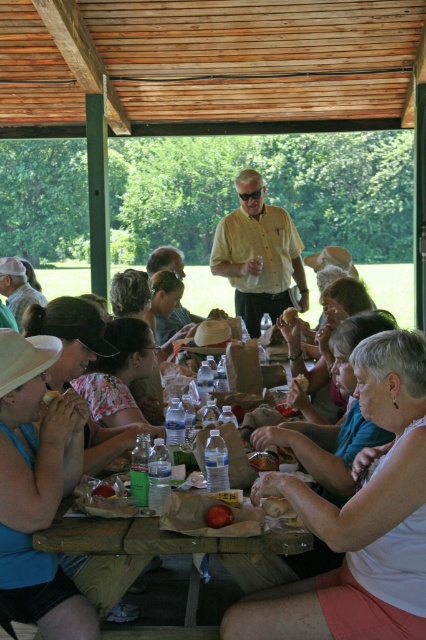
Question: Can you confirm if white cotton shirt at center is positioned to the right of bread at lower right?

Choices:
 (A) yes
 (B) no

Answer: (A)

Question: Which point is closer to the camera?

Choices:
 (A) brown crumbly bread at center
 (B) bread at lower right
 (C) white cotton shirt at center

Answer: (C)

Question: Among these points, which one is farthest from the camera?

Choices:
 (A) (241, 209)
 (B) (8, 410)
 (C) (48, 396)

Answer: (A)

Question: Does white cotton shirt at center lie behind matte yellow bread at lower left?

Choices:
 (A) yes
 (B) no

Answer: (B)

Question: Can you confirm if yellow matte shirt at center is bigger than smooth brown bread at lower left?

Choices:
 (A) no
 (B) yes

Answer: (B)

Question: Which point is farther to the camera?

Choices:
 (A) matte yellow bread at lower left
 (B) matte blue shirt at lower left
 (C) yellow matte shirt at center

Answer: (C)